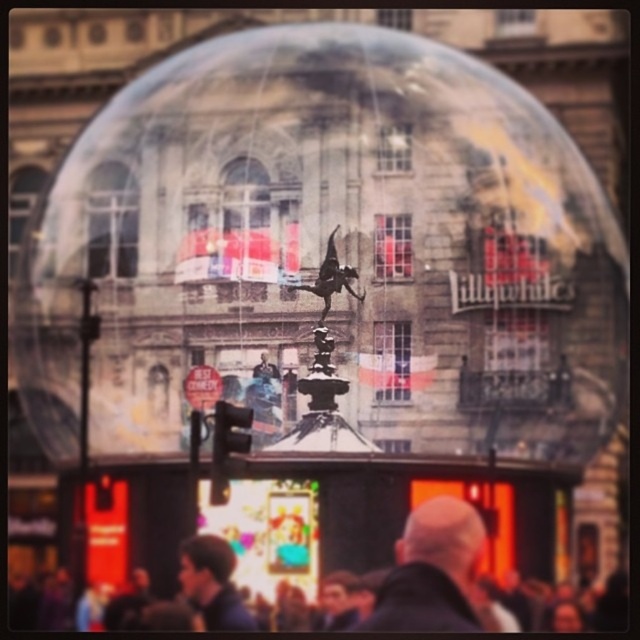
In the scene shown: Does dark hair bald head at center have a greater width compared to dark gray fabric crowd at lower center?

No.

Which of these two, dark hair bald head at center or dark gray fabric crowd at lower center, stands taller?

With more height is dark hair bald head at center.

Find the location of a particular element. This screenshot has width=640, height=640. dark hair bald head at center is located at coordinates (432, 572).

Who is positioned more to the left, dark gray fabric crowd at lower center or dark blue shirt at lower center?

From the viewer's perspective, dark blue shirt at lower center appears more on the left side.

In order to click on dark gray fabric crowd at lower center in this screenshot , I will do `click(38, 605)`.

Does dark hair bald head at center come behind dark blue shirt at lower center?

No, it is in front of dark blue shirt at lower center.

Is point (480, 541) farther from viewer compared to point (189, 588)?

No, it is not.

Find the location of a particular element. dark hair bald head at center is located at coordinates (432, 572).